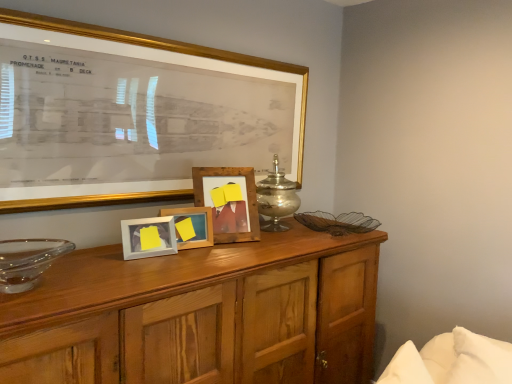
Locate an element on the screen. This screenshot has width=512, height=384. free space that is in between wooden photo frame at center, the 3th picture frame from the front, and transparent glass bowl at left is located at coordinates (113, 261).